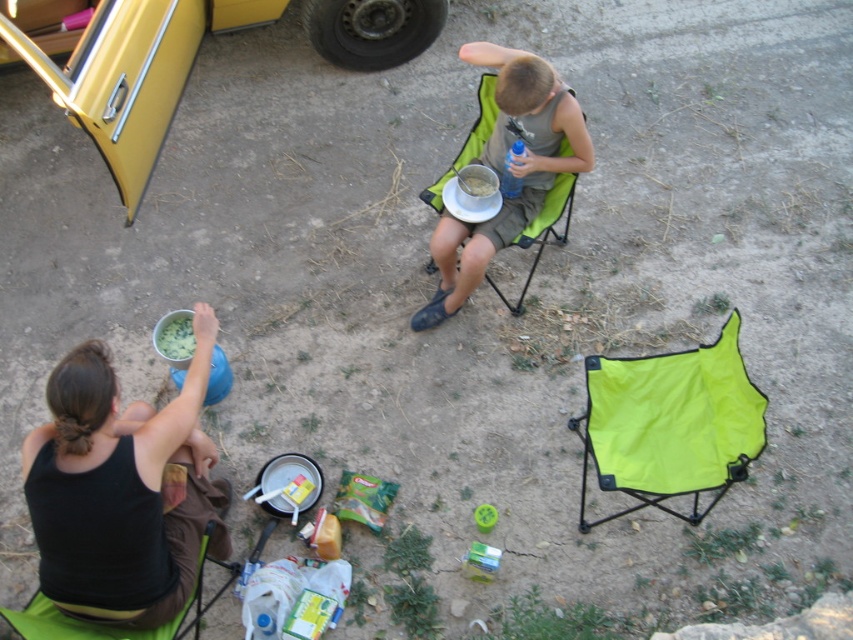
Between point (750, 400) and point (477, 145), which one is positioned behind?

The point (477, 145) is behind.

Image resolution: width=853 pixels, height=640 pixels. I want to click on neon green fabric folding chair at center, so click(670, 422).

Does green fabric chair at lower left have a greater width compared to green matte food at lower left?

Indeed, green fabric chair at lower left has a greater width compared to green matte food at lower left.

Who is more distant from viewer, (112, 628) or (169, 352)?

Point (169, 352)

Describe the element at coordinates (113, 627) in the screenshot. I see `green fabric chair at lower left` at that location.

Where is `green fabric chair at lower left`? The width and height of the screenshot is (853, 640). green fabric chair at lower left is located at coordinates (113, 627).

Can you confirm if matte green chair at center is positioned above green matte food at lower left?

Yes, matte green chair at center is above green matte food at lower left.

Is the position of matte green chair at center less distant than that of green matte food at lower left?

Yes, matte green chair at center is in front of green matte food at lower left.

Does point (486, 45) come farther from viewer compared to point (193, 340)?

That is False.

Find the location of a particular element. The width and height of the screenshot is (853, 640). matte green chair at center is located at coordinates (511, 168).